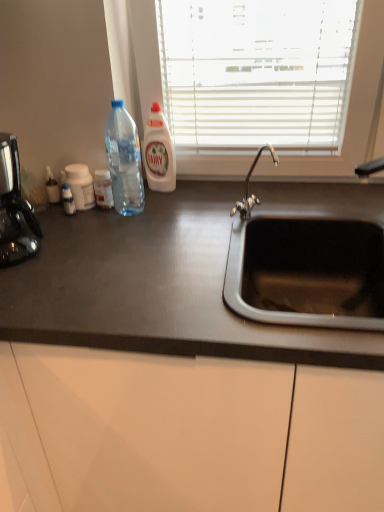
What is the approximate width of black matte countertop at center?

black matte countertop at center is 33.01 inches in width.

Find the location of a particular element. The image size is (384, 512). white plastic bottle at left, the 3th bottle in the right-to-left sequence is located at coordinates (80, 185).

What do you see at coordinates (103, 189) in the screenshot? I see `clear plastic bottle at center, the 2th bottle positioned from the left` at bounding box center [103, 189].

What are the coordinates of `black matte countertop at center` in the screenshot? It's located at (174, 376).

Would you say white plastic bottle at center is inside or outside white plastic bottle at left, positioned as the first bottle in left-to-right order?

white plastic bottle at center is spatially situated outside white plastic bottle at left, positioned as the first bottle in left-to-right order.

Is point (156, 190) closer or farther from the camera than point (75, 179)?

Point (156, 190) is farther from the camera than point (75, 179).

Does white plastic bottle at center turn towards white plastic bottle at left, positioned as the first bottle in left-to-right order?

No, white plastic bottle at center is not turned towards white plastic bottle at left, positioned as the first bottle in left-to-right order.

Looking at this image, is satin black coffee machine at left aimed at white plastic bottle at center?

No, satin black coffee machine at left is not oriented towards white plastic bottle at center.

Which point is more distant from viewer, (3,227) or (156,167)?

Point (156,167)

Can you confirm if satin black coffee machine at left is positioned to the right of white plastic bottle at center?

Incorrect, satin black coffee machine at left is not on the right side of white plastic bottle at center.

Locate an element on the screen. The image size is (384, 512). coffee machine lying in front of the white plastic bottle at center is located at coordinates (15, 209).

Which is correct: black matte countertop at center is inside satin black coffee machine at left, or outside of it?

black matte countertop at center is outside satin black coffee machine at left.

Does black matte countertop at center have a lesser height compared to satin black coffee machine at left?

Incorrect, the height of black matte countertop at center does not fall short of that of satin black coffee machine at left.

Is black matte countertop at center wider or thinner than satin black coffee machine at left?

In the image, black matte countertop at center appears to be wider than satin black coffee machine at left.

How different are the orientations of white plastic bottle at left, positioned as the first bottle in left-to-right order, and transparent plastic bottle at left, the 1th bottle viewed from the right, in degrees?

The angle between the facing direction of white plastic bottle at left, positioned as the first bottle in left-to-right order, and the facing direction of transparent plastic bottle at left, the 1th bottle viewed from the right, is 8.88 degrees.

Which object is further away from the camera, white plastic bottle at left, the 3th bottle in the right-to-left sequence, or transparent plastic bottle at left, the 3th bottle viewed from the left?

white plastic bottle at left, the 3th bottle in the right-to-left sequence, is behind.

Considering the sizes of objects white plastic bottle at left, positioned as the first bottle in left-to-right order, and transparent plastic bottle at left, the 3th bottle viewed from the left, in the image provided, who is thinner, white plastic bottle at left, positioned as the first bottle in left-to-right order, or transparent plastic bottle at left, the 3th bottle viewed from the left,?

Thinner between the two is white plastic bottle at left, positioned as the first bottle in left-to-right order.

Is point (70, 184) more distant than point (138, 200)?

Yes, it is.

Can transparent plastic bottle at left, the 3th bottle viewed from the left, be found inside white plastic bottle at center?

No, transparent plastic bottle at left, the 3th bottle viewed from the left, is located outside of white plastic bottle at center.

You are a GUI agent. You are given a task and a screenshot of the screen. Output one action in this format:
    pyautogui.click(x=<x>, y=<y>)
    Task: Click on the bottle that is the 1st one when counting downward from the white plastic bottle at center (from the image's perspective)
    
    Given the screenshot: What is the action you would take?
    pyautogui.click(x=124, y=160)

From the image's perspective, is white plastic bottle at center below transparent plastic bottle at left, the 1th bottle viewed from the right?

Actually, white plastic bottle at center appears above transparent plastic bottle at left, the 1th bottle viewed from the right, in the image.

Does white plastic bottle at center have a larger size compared to transparent plastic bottle at left, the 1th bottle viewed from the right?

No.

Which of these two, transparent plastic bottle at left, the 1th bottle viewed from the right, or satin black coffee machine at left, stands shorter?

Standing shorter between the two is satin black coffee machine at left.

Does transparent plastic bottle at left, the 3th bottle viewed from the left, touch satin black coffee machine at left?

No, transparent plastic bottle at left, the 3th bottle viewed from the left, is not in contact with satin black coffee machine at left.

Is transparent plastic bottle at left, the 3th bottle viewed from the left, outside of satin black coffee machine at left?

transparent plastic bottle at left, the 3th bottle viewed from the left, is positioned outside satin black coffee machine at left.

From the image's perspective, is satin black coffee machine at left above or below clear plastic bottle at center, the 2th bottle positioned from the left?

From the image's perspective, satin black coffee machine at left appears below clear plastic bottle at center, the 2th bottle positioned from the left.

Considering the relative sizes of satin black coffee machine at left and clear plastic bottle at center, which ranks as the second bottle in right-to-left order, in the image provided, is satin black coffee machine at left thinner than clear plastic bottle at center, which ranks as the second bottle in right-to-left order,?

Incorrect, the width of satin black coffee machine at left is not less than that of clear plastic bottle at center, which ranks as the second bottle in right-to-left order.

Is there a large distance between satin black coffee machine at left and clear plastic bottle at center, the 2th bottle positioned from the left?

They are positioned close to each other.

There is a white plastic bottle at left, the 3th bottle in the right-to-left sequence. What are the coordinates of `cleaning product above it (from a real-world perspective)` in the screenshot? It's located at (159, 152).

This screenshot has height=512, width=384. In order to click on coffee machine beneath the white plastic bottle at center (from a real-world perspective) in this screenshot , I will do `click(15, 209)`.

Looking at the image, which one is located closer to clear plastic bottle at center, the 2th bottle positioned from the left, transparent plastic bottle at left, the 1th bottle viewed from the right, or black matte countertop at center?

transparent plastic bottle at left, the 1th bottle viewed from the right, lies closer to clear plastic bottle at center, the 2th bottle positioned from the left, than the other object.

Looking at the image, which one is located further to transparent plastic bottle at left, the 3th bottle viewed from the left, white plastic bottle at center or black matte countertop at center?

Among the two, black matte countertop at center is located further to transparent plastic bottle at left, the 3th bottle viewed from the left.

Considering their positions, is satin black coffee machine at left positioned further to black matte countertop at center than white plastic bottle at left, the 3th bottle in the right-to-left sequence?

Among the two, white plastic bottle at left, the 3th bottle in the right-to-left sequence, is located further to black matte countertop at center.

Considering their positions, is clear plastic bottle at center, which ranks as the second bottle in right-to-left order, positioned closer to black matte countertop at center than white plastic bottle at center?

clear plastic bottle at center, which ranks as the second bottle in right-to-left order, lies closer to black matte countertop at center than the other object.

When comparing their distances from satin black coffee machine at left, does transparent plastic bottle at left, the 1th bottle viewed from the right, or black matte countertop at center seem further?

black matte countertop at center is further to satin black coffee machine at left.

Based on the photo, estimate the real-world distances between objects in this image. Which object is closer to satin black coffee machine at left, white plastic bottle at center or white plastic bottle at left, the 3th bottle in the right-to-left sequence?

Among the two, white plastic bottle at left, the 3th bottle in the right-to-left sequence, is located nearer to satin black coffee machine at left.

Based on the photo, considering their positions, is white plastic bottle at center positioned further to transparent plastic bottle at left, the 3th bottle viewed from the left, than clear plastic bottle at center, which ranks as the second bottle in right-to-left order?

Among the two, white plastic bottle at center is located further to transparent plastic bottle at left, the 3th bottle viewed from the left.

Based on their spatial positions, is satin black coffee machine at left or transparent plastic bottle at left, the 3th bottle viewed from the left, further from black matte countertop at center?

transparent plastic bottle at left, the 3th bottle viewed from the left, is further to black matte countertop at center.

Where is `coffee machine that lies between white plastic bottle at center and black matte countertop at center from top to bottom`? The height and width of the screenshot is (512, 384). coffee machine that lies between white plastic bottle at center and black matte countertop at center from top to bottom is located at coordinates (15, 209).

You are a GUI agent. You are given a task and a screenshot of the screen. Output one action in this format:
    pyautogui.click(x=<x>, y=<y>)
    Task: Click on the bottle between transparent plastic bottle at left, the 3th bottle viewed from the left, and clear plastic bottle at center, which ranks as the second bottle in right-to-left order, in the front-back direction
    
    Given the screenshot: What is the action you would take?
    pyautogui.click(x=80, y=185)

Locate an element on the screen. This screenshot has width=384, height=512. bottle between satin black coffee machine at left and white plastic bottle at left, positioned as the first bottle in left-to-right order, along the z-axis is located at coordinates (124, 160).